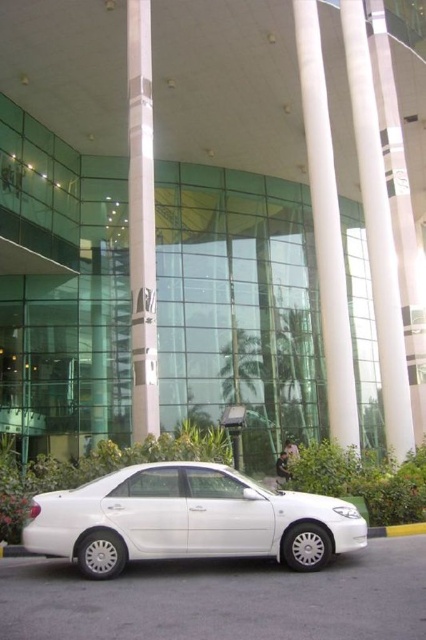
Question: Which object appears farthest from the camera in this image?

Choices:
 (A) white glossy pillar at center
 (B) white smooth pillar at center

Answer: (B)

Question: Can you confirm if white smooth pillar at center is positioned below white glossy pillar at center?

Choices:
 (A) no
 (B) yes

Answer: (B)

Question: Which object is farther from the camera taking this photo?

Choices:
 (A) gray concrete curb at lower right
 (B) white glossy pillar at center
 (C) white glossy sedan at lower center
 (D) white glossy pillar at right

Answer: (D)

Question: From the image, what is the correct spatial relationship of white glossy pillar at right in relation to gray concrete curb at lower right?

Choices:
 (A) below
 (B) above

Answer: (B)

Question: Which object appears closest to the camera in this image?

Choices:
 (A) white glossy sedan at lower center
 (B) white smooth pillar at center

Answer: (A)

Question: Does white glossy pillar at center appear under gray concrete curb at lower right?

Choices:
 (A) yes
 (B) no

Answer: (B)